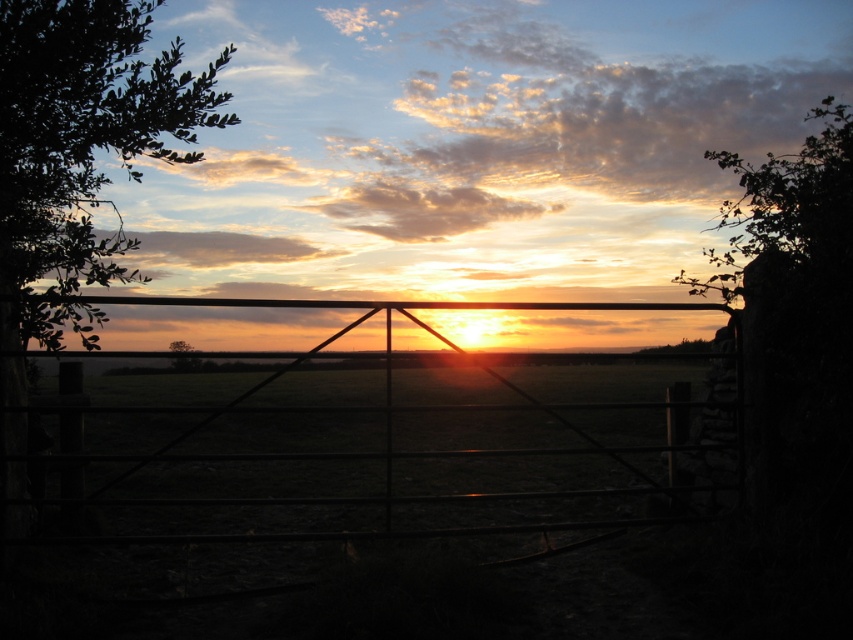
You are a bird flying over the rural scene and want to land on the tallest tree. Which tree should you choose between the green leafy tree at upper right and the green leafy tree at center?

The green leafy tree at upper right is bigger than the green leafy tree at center, so you should choose the green leafy tree at upper right to land on.

Based on the photo, you are standing at the center of the field in the middle ground. Looking towards the horizon, where would you see the green leafy tree at upper right?

The green leafy tree at upper right is located at point 0.333 on the x axis and 0.928 on the y axis, so it would be positioned to the left of the center point on the horizon.